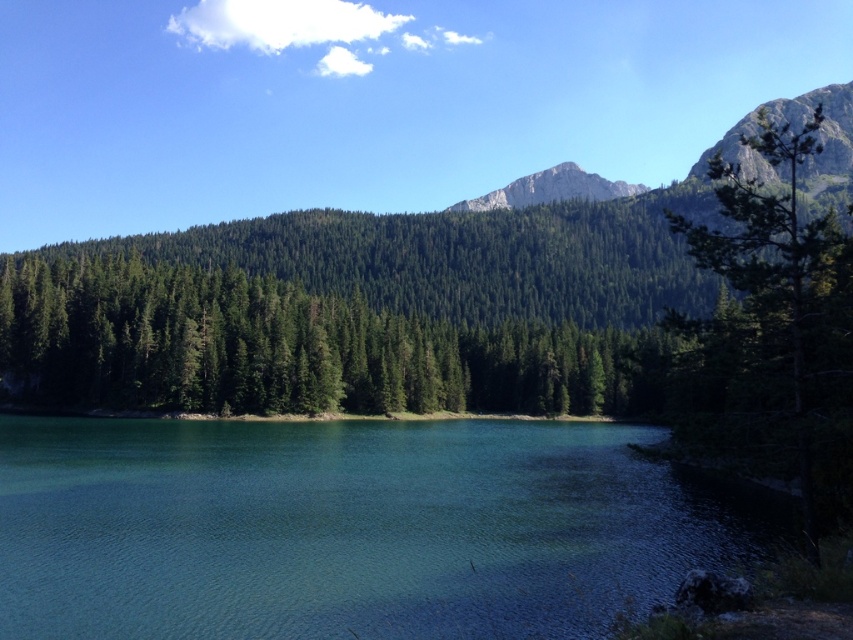
You are an artist planning to paint this landscape. You want to emphasize the clear glassy water at center and the rugged granite mountain at upper center. Which object should you paint first if you want the one taking up more space to be prominent?

The rugged granite mountain at upper center takes up more space than the clear glassy water at center, so you should paint the rugged granite mountain at upper center first to ensure its prominence.

You are standing at the edge of the water in the serene landscape. You notice two points marked on the image. The first point is at coordinates point (39, 436), and the second is at point (216, 280). Which of these two points is closer to you?

Point (39, 436) is closer to you because it is in front of point (216, 280) according to their positions in the image.